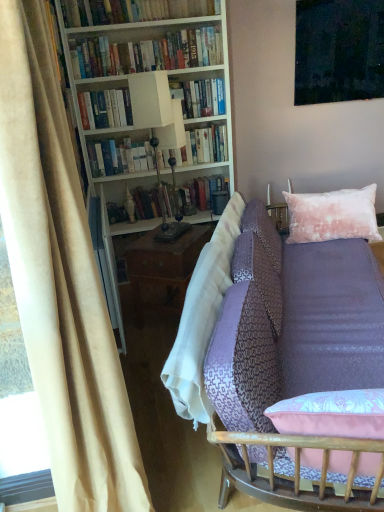
This screenshot has width=384, height=512. I want to click on empty space that is ontop of hardcover books at upper center, marked as the second book in a bottom-to-top arrangement (from a real-world perspective), so click(198, 77).